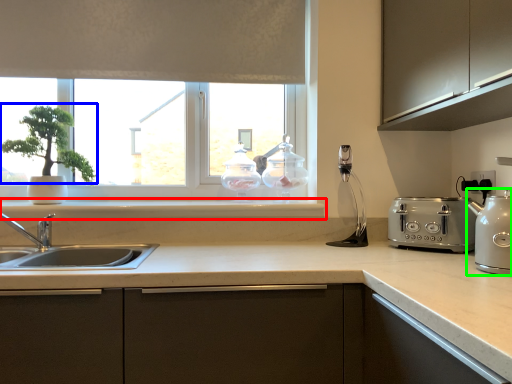
Question: Which object is positioned farthest from window sill (highlighted by a red box)? Select from plant (highlighted by a blue box) and kitchen appliance (highlighted by a green box).

Choices:
 (A) plant
 (B) kitchen appliance

Answer: (B)